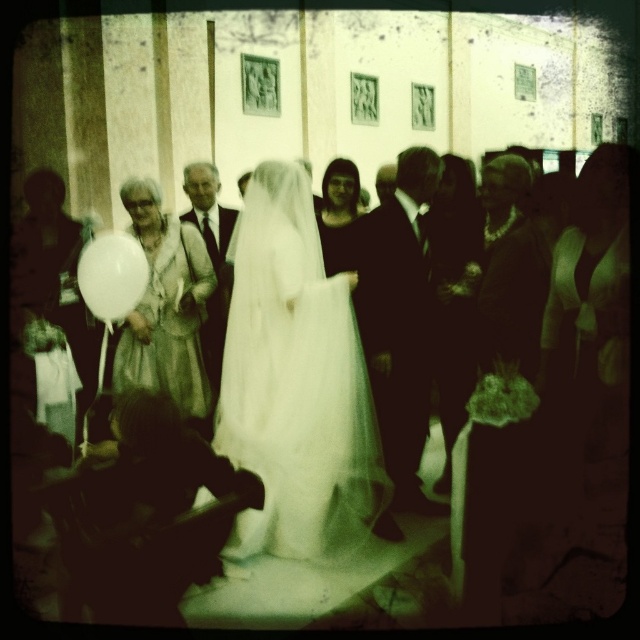
Which is more to the left, white sheer dress at center or shiny black suit at center?

Positioned to the left is white sheer dress at center.

This screenshot has height=640, width=640. I want to click on white sheer dress at center, so coord(296,384).

What are the coordinates of `white sheer dress at center` in the screenshot? It's located at (296, 384).

Does light brown suit at center have a lesser width compared to white matte balloon at left?

Indeed, light brown suit at center has a lesser width compared to white matte balloon at left.

Who is positioned more to the right, light brown suit at center or white matte balloon at left?

light brown suit at center is more to the right.

Is point (216, 340) farther from viewer compared to point (113, 241)?

That is True.

Locate an element on the screen. light brown suit at center is located at coordinates (211, 257).

Is matte black suit at right above light brown suit at center?

Incorrect, matte black suit at right is not positioned above light brown suit at center.

Does point (465, 532) come farther from viewer compared to point (186, 172)?

No, (465, 532) is in front of (186, 172).

The height and width of the screenshot is (640, 640). What are the coordinates of `matte black suit at right` in the screenshot? It's located at (500, 396).